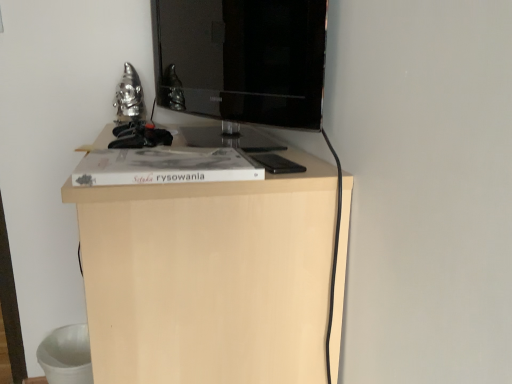
What do you see at coordinates (242, 60) in the screenshot? I see `matte black tv at center` at bounding box center [242, 60].

What are the coordinates of `matte black tv at center` in the screenshot? It's located at (242, 60).

Image resolution: width=512 pixels, height=384 pixels. What do you see at coordinates (210, 277) in the screenshot?
I see `light wood cabinet at center` at bounding box center [210, 277].

Identify the location of light wood cabinet at center. The height and width of the screenshot is (384, 512). (210, 277).

You are a GUI agent. You are given a task and a screenshot of the screen. Output one action in this format:
    pyautogui.click(x=<x>, y=<y>)
    Task: Click on the matte black tv at center
    The height and width of the screenshot is (384, 512).
    Given the screenshot: What is the action you would take?
    pyautogui.click(x=242, y=60)

Considering the positions of objects matte black tv at center and light wood cabinet at center in the image provided, who is more to the left, matte black tv at center or light wood cabinet at center?

light wood cabinet at center.

Which object is further away from the camera, matte black tv at center or light wood cabinet at center?

matte black tv at center.

Considering the points (179, 82) and (321, 369), which point is behind, point (179, 82) or point (321, 369)?

Positioned behind is point (179, 82).

From the image's perspective, would you say matte black tv at center is positioned over light wood cabinet at center?

Yes, from the image's perspective, matte black tv at center is on top of light wood cabinet at center.

From a real-world perspective, is matte black tv at center positioned over light wood cabinet at center based on gravity?

Correct, in the physical world, matte black tv at center is higher than light wood cabinet at center.

Based on the photo, which object is wider, matte black tv at center or light wood cabinet at center?

Wider between the two is light wood cabinet at center.

Does matte black tv at center have a lesser height compared to light wood cabinet at center?

Yes, matte black tv at center is shorter than light wood cabinet at center.

Does matte black tv at center have a larger size compared to light wood cabinet at center?

No, matte black tv at center is not bigger than light wood cabinet at center.

Would you say light wood cabinet at center is part of matte black tv at center's contents?

No, matte black tv at center does not contain light wood cabinet at center.

Would you say matte black tv at center is a long distance from light wood cabinet at center?

matte black tv at center is actually quite close to light wood cabinet at center.

Could you tell me if matte black tv at center is facing light wood cabinet at center?

No, matte black tv at center is not turned towards light wood cabinet at center.

Can you tell me how much matte black tv at center and light wood cabinet at center differ in facing direction?

There is a 21.7-degree angle between the facing directions of matte black tv at center and light wood cabinet at center.

How far apart are matte black tv at center and light wood cabinet at center?

matte black tv at center is 15.99 inches away from light wood cabinet at center.

At what (x,y) coordinates should I click in order to perform the action: click on furniture directly beneath the matte black tv at center (from a real-world perspective). Please return your answer as a coordinate pair (x, y). The width and height of the screenshot is (512, 384). Looking at the image, I should click on (210, 277).

Would you say light wood cabinet at center is to the left or to the right of matte black tv at center in the picture?

Clearly, light wood cabinet at center is on the left of matte black tv at center in the image.

Is light wood cabinet at center in front of or behind matte black tv at center in the image?

light wood cabinet at center is in front of matte black tv at center.

Is point (90, 199) more distant than point (245, 52)?

That is False.

From the image's perspective, which is below, light wood cabinet at center or matte black tv at center?

light wood cabinet at center appears lower in the image.

From a real-world perspective, is light wood cabinet at center physically located above or below matte black tv at center?

light wood cabinet at center is situated lower than matte black tv at center in the real world.

Is light wood cabinet at center wider or thinner than matte black tv at center?

light wood cabinet at center is wider than matte black tv at center.

Can you confirm if light wood cabinet at center is shorter than matte black tv at center?

No.

Can you confirm if light wood cabinet at center is bigger than matte black tv at center?

Indeed, light wood cabinet at center has a larger size compared to matte black tv at center.

Can matte black tv at center be found inside light wood cabinet at center?

Actually, matte black tv at center is outside light wood cabinet at center.

Is there a large distance between light wood cabinet at center and matte black tv at center?

No, light wood cabinet at center is not far away from matte black tv at center.

Is light wood cabinet at center aimed at matte black tv at center?

No, light wood cabinet at center is not oriented towards matte black tv at center.

What's the angular difference between light wood cabinet at center and matte black tv at center's facing directions?

The angular difference between light wood cabinet at center and matte black tv at center is 21.7 degrees.

You are a GUI agent. You are given a task and a screenshot of the screen. Output one action in this format:
    pyautogui.click(x=<x>, y=<y>)
    Task: Click on the furniture in front of the matte black tv at center
    The width and height of the screenshot is (512, 384).
    Given the screenshot: What is the action you would take?
    pyautogui.click(x=210, y=277)

Locate an element on the screen. furniture that appears in front of the matte black tv at center is located at coordinates (210, 277).

The image size is (512, 384). Identify the location of television behind the light wood cabinet at center. tap(242, 60).